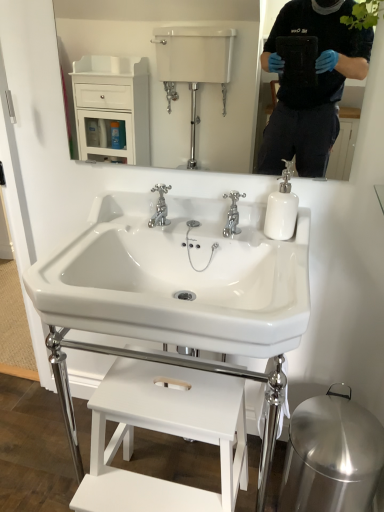
What do you see at coordinates (232, 214) in the screenshot? I see `chrome metallic faucet at center` at bounding box center [232, 214].

I want to click on white matte stool at lower center, so click(164, 432).

This screenshot has width=384, height=512. Find the location of `white glossy sink at center`. white glossy sink at center is located at coordinates (179, 278).

Identify the location of white glossy mirror at upper center. This screenshot has height=512, width=384. (178, 84).

Where is `chrome metallic faucet at center`? chrome metallic faucet at center is located at coordinates (232, 214).

Would you consider chrome metallic faucet at center to be distant from white glossy mirror at upper center?

chrome metallic faucet at center is positioned a significant distance from white glossy mirror at upper center.

From the image's perspective, is chrome metallic faucet at center under white glossy mirror at upper center?

Yes, from the image's perspective, chrome metallic faucet at center is beneath white glossy mirror at upper center.

Is chrome metallic faucet at center looking in the opposite direction of white glossy mirror at upper center?

No, chrome metallic faucet at center is not facing away from white glossy mirror at upper center.

Does chrome metallic faucet at center have a larger size compared to white glossy mirror at upper center?

Incorrect, chrome metallic faucet at center is not larger than white glossy mirror at upper center.

Identify the location of mirror behind the white matte stool at lower center. (178, 84).

Could you tell me if white glossy mirror at upper center is facing white matte stool at lower center?

No.

From a real-world perspective, between white glossy mirror at upper center and white matte stool at lower center, who is vertically higher?

white glossy mirror at upper center.

Can you confirm if white glossy mirror at upper center is wider than white matte stool at lower center?

No.

Considering the sizes of objects white glossy mirror at upper center and white glossy soap dispenser at upper right in the image provided, who is wider, white glossy mirror at upper center or white glossy soap dispenser at upper right?

Wider between the two is white glossy soap dispenser at upper right.

Which object is closer to the camera, white glossy mirror at upper center or white glossy soap dispenser at upper right?

Positioned in front is white glossy mirror at upper center.

From the image's perspective, relative to white glossy soap dispenser at upper right, is white glossy mirror at upper center above or below?

From the image's perspective, white glossy mirror at upper center appears above white glossy soap dispenser at upper right.

Is white glossy sink at center surrounding chrome metallic faucet at center?

Yes, chrome metallic faucet at center can be found within white glossy sink at center.

In terms of width, does white glossy sink at center look wider or thinner when compared to chrome metallic faucet at center?

Considering their sizes, white glossy sink at center looks broader than chrome metallic faucet at center.

Which object is further away from the camera, white glossy sink at center or chrome metallic faucet at center?

chrome metallic faucet at center.

Are white glossy mirror at upper center and white glossy sink at center making contact?

white glossy mirror at upper center and white glossy sink at center are not in contact.

Is white glossy mirror at upper center facing towards white glossy sink at center?

No, white glossy mirror at upper center does not turn towards white glossy sink at center.

Considering the relative sizes of white glossy mirror at upper center and white glossy sink at center in the image provided, is white glossy mirror at upper center wider than white glossy sink at center?

No.

Considering the relative positions of white glossy mirror at upper center and white glossy sink at center in the image provided, is white glossy mirror at upper center to the left or to the right of white glossy sink at center?

Based on their positions, white glossy mirror at upper center is located to the right of white glossy sink at center.

Relative to white glossy sink at center, is chrome metallic faucet at center in front or behind?

In the image, chrome metallic faucet at center appears behind white glossy sink at center.

Choose the correct answer: Is chrome metallic faucet at center inside white glossy sink at center or outside it?

chrome metallic faucet at center is located inside white glossy sink at center.

From the image's perspective, is chrome metallic faucet at center under white glossy sink at center?

No, from the image's perspective, chrome metallic faucet at center is not below white glossy sink at center.

From the image's perspective, is white glossy sink at center located above or below white glossy soap dispenser at upper right?

Based on their image positions, white glossy sink at center is located beneath white glossy soap dispenser at upper right.

Is point (259, 298) in front of point (283, 192)?

Yes, it is.

In terms of size, does white glossy sink at center appear bigger or smaller than white glossy soap dispenser at upper right?

white glossy sink at center is bigger than white glossy soap dispenser at upper right.

Is white glossy sink at center oriented away from white glossy soap dispenser at upper right?

No.

Locate an element on the screen. tap behind the white glossy mirror at upper center is located at coordinates (232, 214).

Where is `mirror that appears above the white matte stool at lower center (from the image's perspective)`? The height and width of the screenshot is (512, 384). mirror that appears above the white matte stool at lower center (from the image's perspective) is located at coordinates (178, 84).

From the picture: Considering their positions, is white glossy mirror at upper center positioned further to white matte stool at lower center than white glossy soap dispenser at upper right?

white glossy mirror at upper center.

Based on their spatial positions, is white glossy mirror at upper center or chrome metallic faucet at center further from white glossy sink at center?

white glossy mirror at upper center.

Which object lies nearer to the anchor point chrome metallic faucet at center, white glossy sink at center or white glossy soap dispenser at upper right?

white glossy soap dispenser at upper right lies closer to chrome metallic faucet at center than the other object.

From the image, which object appears to be farther from white glossy sink at center, white glossy soap dispenser at upper right or chrome metallic faucet at center?

chrome metallic faucet at center lies further to white glossy sink at center than the other object.

Considering their positions, is white glossy soap dispenser at upper right positioned closer to white matte stool at lower center than white glossy sink at center?

white glossy sink at center.

Which object lies nearer to the anchor point white matte stool at lower center, white glossy soap dispenser at upper right or chrome metallic faucet at center?

Among the two, white glossy soap dispenser at upper right is located nearer to white matte stool at lower center.

When comparing their distances from white glossy sink at center, does white glossy mirror at upper center or white matte stool at lower center seem further?

white glossy mirror at upper center is further to white glossy sink at center.

Based on their spatial positions, is white matte stool at lower center or white glossy sink at center closer to chrome metallic faucet at center?

Among the two, white glossy sink at center is located nearer to chrome metallic faucet at center.

Identify the location of sink between chrome metallic faucet at center and white matte stool at lower center in the up-down direction. (179, 278).

The width and height of the screenshot is (384, 512). I want to click on tap between white glossy mirror at upper center and white glossy sink at center vertically, so click(232, 214).

The width and height of the screenshot is (384, 512). Find the location of `soap dispenser that lies between white glossy mirror at upper center and white glossy sink at center from top to bottom`. soap dispenser that lies between white glossy mirror at upper center and white glossy sink at center from top to bottom is located at coordinates (282, 208).

Where is `tap positioned between white glossy sink at center and white glossy soap dispenser at upper right from near to far`? Image resolution: width=384 pixels, height=512 pixels. tap positioned between white glossy sink at center and white glossy soap dispenser at upper right from near to far is located at coordinates (232, 214).